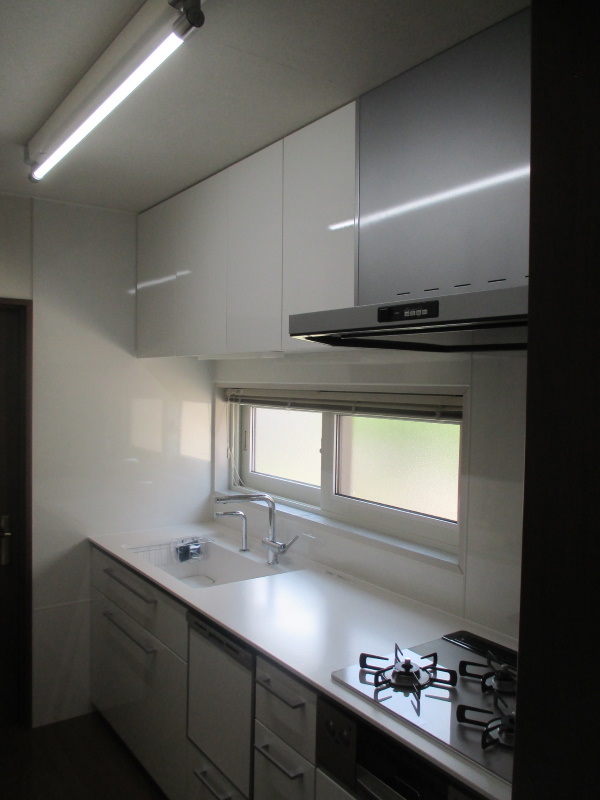
This screenshot has width=600, height=800. I want to click on rangehood buttons, so click(x=406, y=312), click(x=413, y=312), click(x=419, y=310), click(x=425, y=310).